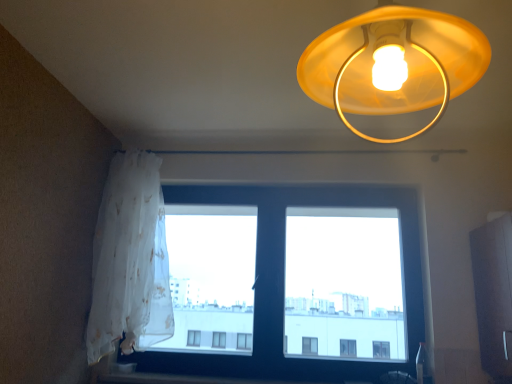
Question: From the image's perspective, is translucent yellow plastic lampshade at upper center below transparent fabric at lower left?

Choices:
 (A) yes
 (B) no

Answer: (B)

Question: From a real-world perspective, is translucent yellow plastic lampshade at upper center on transparent fabric at lower left?

Choices:
 (A) no
 (B) yes

Answer: (B)

Question: Is transparent fabric at lower left at the back of translucent yellow plastic lampshade at upper center?

Choices:
 (A) yes
 (B) no

Answer: (A)

Question: Is translucent yellow plastic lampshade at upper center wider than transparent fabric at lower left?

Choices:
 (A) yes
 (B) no

Answer: (A)

Question: Considering the relative sizes of translucent yellow plastic lampshade at upper center and transparent fabric at lower left in the image provided, is translucent yellow plastic lampshade at upper center bigger than transparent fabric at lower left?

Choices:
 (A) no
 (B) yes

Answer: (A)

Question: Is transparent fabric at lower left located within translucent yellow plastic lampshade at upper center?

Choices:
 (A) no
 (B) yes

Answer: (A)

Question: Is transparent fabric at lower left outside of smooth wood window sill at lower center?

Choices:
 (A) no
 (B) yes

Answer: (B)

Question: Is transparent fabric at lower left positioned behind smooth wood window sill at lower center?

Choices:
 (A) no
 (B) yes

Answer: (B)

Question: From a real-world perspective, is transparent fabric at lower left located beneath smooth wood window sill at lower center?

Choices:
 (A) yes
 (B) no

Answer: (B)

Question: From a real-world perspective, is transparent fabric at lower left over smooth wood window sill at lower center?

Choices:
 (A) yes
 (B) no

Answer: (A)

Question: Is transparent fabric at lower left with smooth wood window sill at lower center?

Choices:
 (A) yes
 (B) no

Answer: (B)

Question: Is smooth wood window sill at lower center inside transparent fabric at lower left?

Choices:
 (A) yes
 (B) no

Answer: (B)

Question: Does transparent fabric at lower left turn towards translucent yellow plastic lampshade at upper center?

Choices:
 (A) no
 (B) yes

Answer: (B)